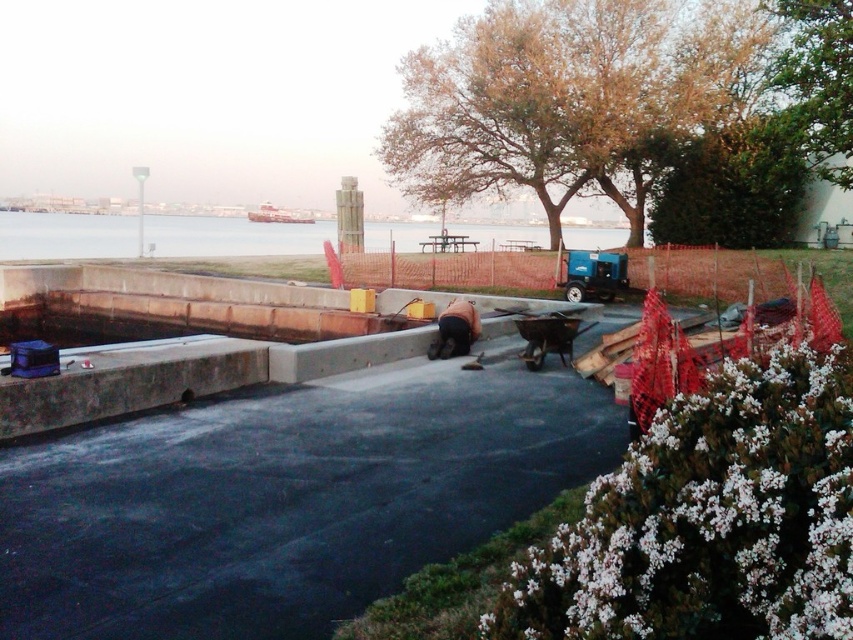
You are a construction worker standing at the edge of the freshly poured concrete surface. You need to locate the brown leafy tree at upper center. According to the coordinates provided, in which direction should you look to find it?

The brown leafy tree at upper center is located at coordinates point (572, 99), so you should look towards the upper left direction to find it.

You are standing at the construction site and see two points marked on the ground. The first point is at coordinates point (122, 360) and the second is at point (428, 356). Which point is closer to you?

Point (122, 360) is in front of point (428, 356), so it is closer to you.